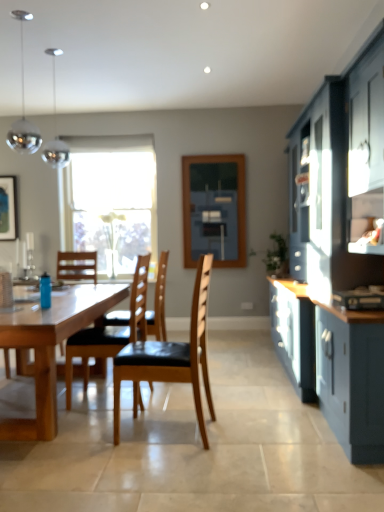
Question: Considering the relative sizes of natural wood table at center and matte black picture frame at upper left in the image provided, is natural wood table at center bigger than matte black picture frame at upper left?

Choices:
 (A) yes
 (B) no

Answer: (A)

Question: From the image's perspective, does natural wood table at center appear lower than matte black picture frame at upper left?

Choices:
 (A) yes
 (B) no

Answer: (A)

Question: Is natural wood table at center shorter than matte black picture frame at upper left?

Choices:
 (A) yes
 (B) no

Answer: (A)

Question: Could you tell me if natural wood table at center is facing matte black picture frame at upper left?

Choices:
 (A) no
 (B) yes

Answer: (A)

Question: Is natural wood table at center far away from matte black picture frame at upper left?

Choices:
 (A) yes
 (B) no

Answer: (A)

Question: In terms of size, does natural wood table at center appear bigger or smaller than wooden chair with black seat cushion at center, which is the third chair in front-to-back order?

Choices:
 (A) big
 (B) small

Answer: (A)

Question: Looking at their shapes, would you say natural wood table at center is wider or thinner than wooden chair with black seat cushion at center, the 1th chair from the back?

Choices:
 (A) thin
 (B) wide

Answer: (B)

Question: Is natural wood table at center spatially inside wooden chair with black seat cushion at center, the 1th chair from the back, or outside of it?

Choices:
 (A) outside
 (B) inside

Answer: (A)

Question: From a real-world perspective, is natural wood table at center physically located above or below wooden chair with black seat cushion at center, the 1th chair from the back?

Choices:
 (A) above
 (B) below

Answer: (B)

Question: Considering the positions of white plastic power outlet at center and matte dark blue cabinet at right in the image, is white plastic power outlet at center taller or shorter than matte dark blue cabinet at right?

Choices:
 (A) tall
 (B) short

Answer: (B)

Question: Does point (251, 304) appear closer or farther from the camera than point (382, 373)?

Choices:
 (A) closer
 (B) farther

Answer: (B)

Question: Would you say white plastic power outlet at center is inside or outside matte dark blue cabinet at right?

Choices:
 (A) inside
 (B) outside

Answer: (B)

Question: Considering the positions of white plastic power outlet at center and matte dark blue cabinet at right in the image, is white plastic power outlet at center bigger or smaller than matte dark blue cabinet at right?

Choices:
 (A) big
 (B) small

Answer: (B)

Question: Is transparent glass window at center in front of or behind satin chrome pendant lights at upper left in the image?

Choices:
 (A) behind
 (B) front

Answer: (A)

Question: Considering the positions of point (76, 222) and point (49, 50), is point (76, 222) closer or farther from the camera than point (49, 50)?

Choices:
 (A) farther
 (B) closer

Answer: (A)